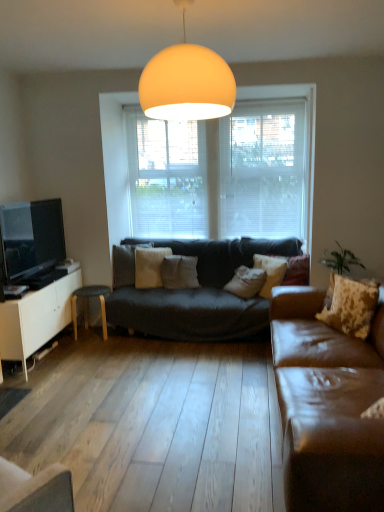
Question: Would you say white cotton pillow at center, which is the first pillow in back-to-front order, is inside or outside white sheer blinds at center?

Choices:
 (A) inside
 (B) outside

Answer: (B)

Question: In terms of height, does white cotton pillow at center, arranged as the second pillow when viewed from the left, look taller or shorter compared to white sheer blinds at center?

Choices:
 (A) tall
 (B) short

Answer: (B)

Question: Which is nearer to the white blinds at center, the first window screen positioned from the left?

Choices:
 (A) brown leather couch at right
 (B) wooden stool at left
 (C) white cotton pillow at center, which is the 3th pillow in right-to-left order
 (D) white matte cabinet at left
 (E) matte black tv at left

Answer: (C)

Question: Which of these objects is positioned farthest from the brown leather couch at right?

Choices:
 (A) white matte cabinet at left
 (B) wooden stool at left
 (C) white blinds at center, the first window screen positioned from the left
 (D) matte black tv at left
 (E) matte orange globe at upper center

Answer: (D)